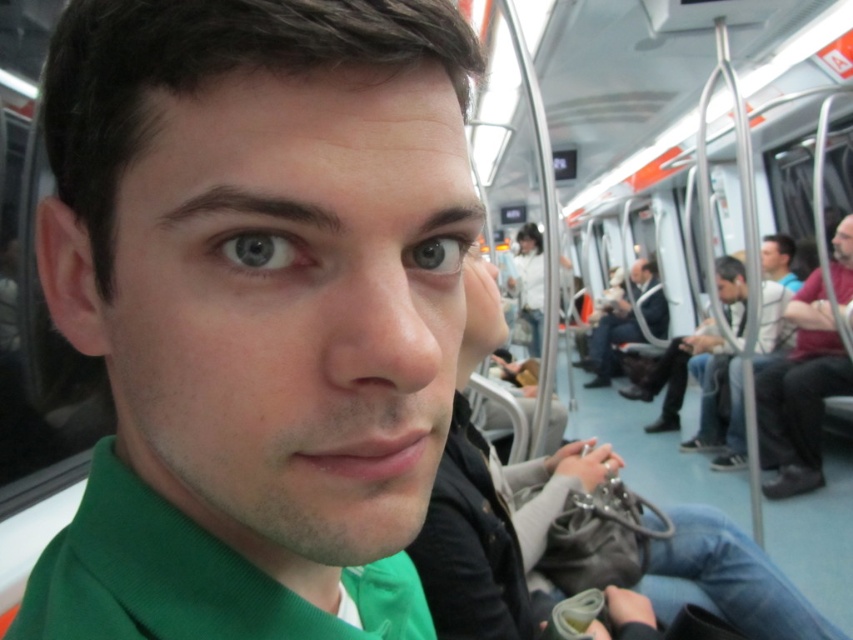
You are a passenger on the train and want to know if the blue glossy eye at center is visible from your seat. Can you see it if you look towards the dark blue jeans at right?

The blue glossy eye at center is behind dark blue jeans at right, so it might be blocked from view if the dark blue jeans at right are in front of it.

You are a passenger on the subway and want to place your phone on the nearest surface. You see the dark blue jeans at right and the blue glossy eye at center. Which surface can you place your phone on?

The dark blue jeans at right is located below the blue glossy eye at center, so you can place your phone on the dark blue jeans at right.

In the scene shown: You are a fashion designer observing a subway scene. You notice the green matte sweater at center and the dark blue jeans at right. Which clothing item appears narrower in width?

The green matte sweater at center is thinner than the dark blue jeans at right, so the green matte sweater at center appears narrower in width.